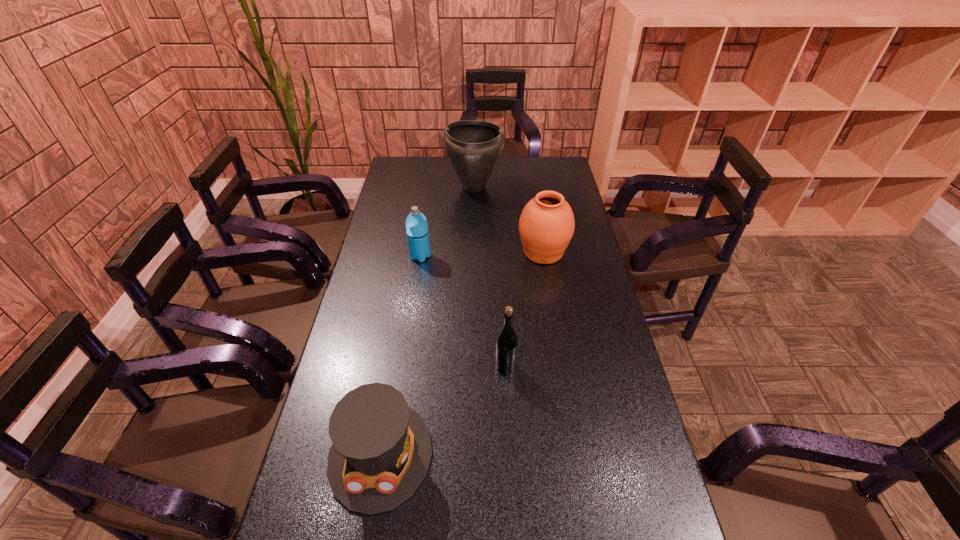
Image resolution: width=960 pixels, height=540 pixels. Identify the location of free space located on the left of the nearer urn. (453, 252).

Locate an element on the screen. free space located on the right of the thermos bottle is located at coordinates (468, 256).

At what (x,y) coordinates should I click in order to perform the action: click on object that is positioned at the far edge. Please return your answer as a coordinate pair (x, y). Looking at the image, I should click on (473, 147).

What are the coordinates of `thermos bottle at the left edge` in the screenshot? It's located at (416, 224).

Find the location of `dress hat present at the left edge`. dress hat present at the left edge is located at coordinates (381, 451).

Locate an element on the screen. object present at the right edge is located at coordinates (546, 226).

Find the location of a particular element. vacant space at the far edge is located at coordinates pos(516,161).

Find the location of `free region at the left edge of the desktop`. free region at the left edge of the desktop is located at coordinates (395, 213).

Identify the location of free location at the right edge of the desktop. (571, 308).

Locate an element on the screen. This screenshot has width=960, height=540. blank area at the far right corner is located at coordinates (538, 174).